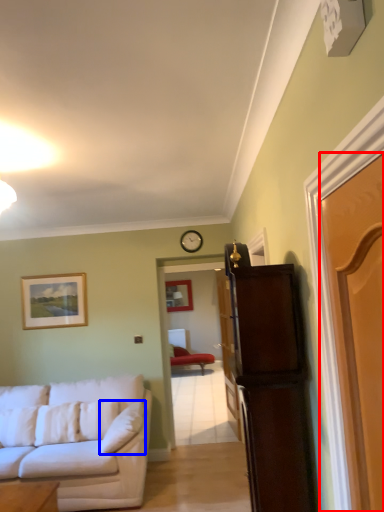
Question: Which object appears farthest to the camera in this image, door (highlighted by a red box) or pillow (highlighted by a blue box)?

Choices:
 (A) door
 (B) pillow

Answer: (B)